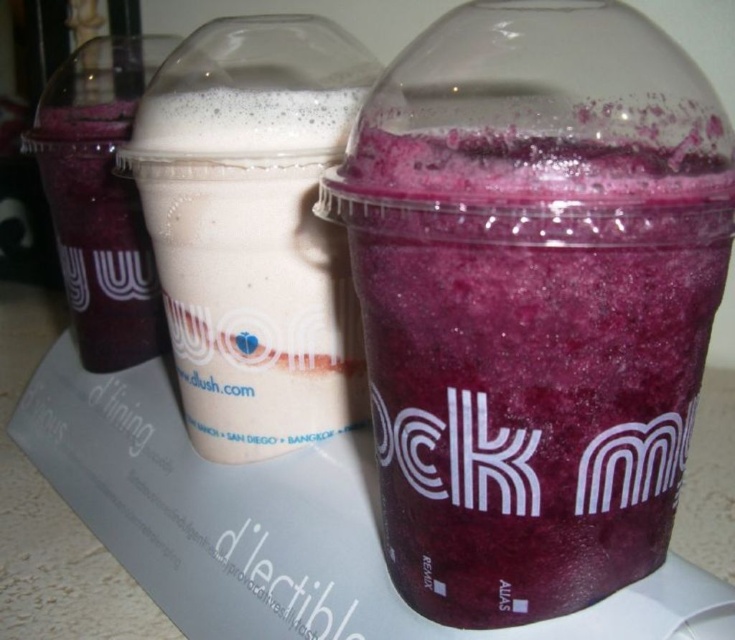
Question: Which point is farther to the camera?

Choices:
 (A) (373, 182)
 (B) (294, 92)

Answer: (B)

Question: Does purple matte smoothie at right have a smaller size compared to smooth white milkshake at center?

Choices:
 (A) yes
 (B) no

Answer: (B)

Question: Does purple matte smoothie at right appear on the right side of smooth white milkshake at center?

Choices:
 (A) yes
 (B) no

Answer: (A)

Question: Does purple matte smoothie at right appear on the right side of smooth white milkshake at center?

Choices:
 (A) yes
 (B) no

Answer: (A)

Question: Among these points, which one is farthest from the camera?

Choices:
 (A) (456, 268)
 (B) (223, 404)

Answer: (B)